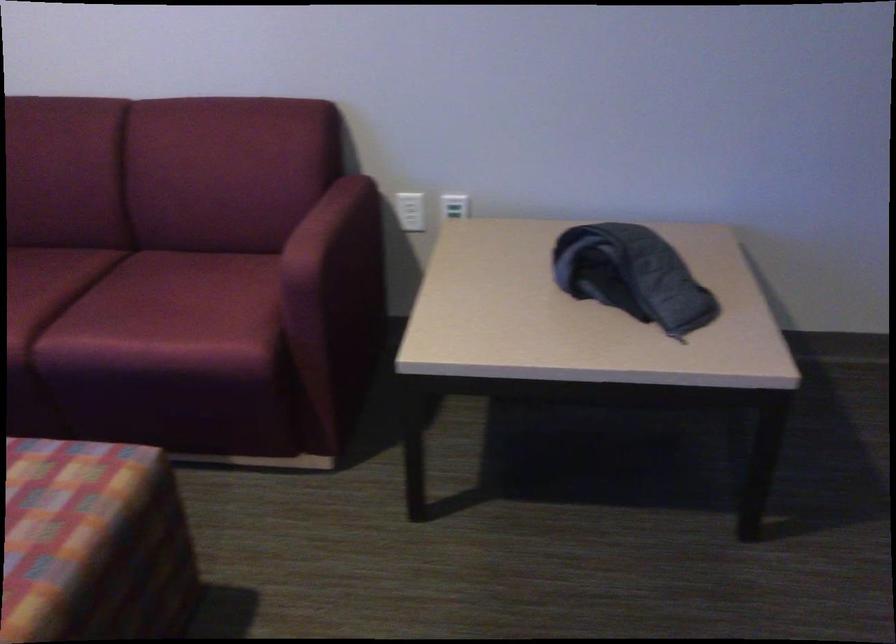
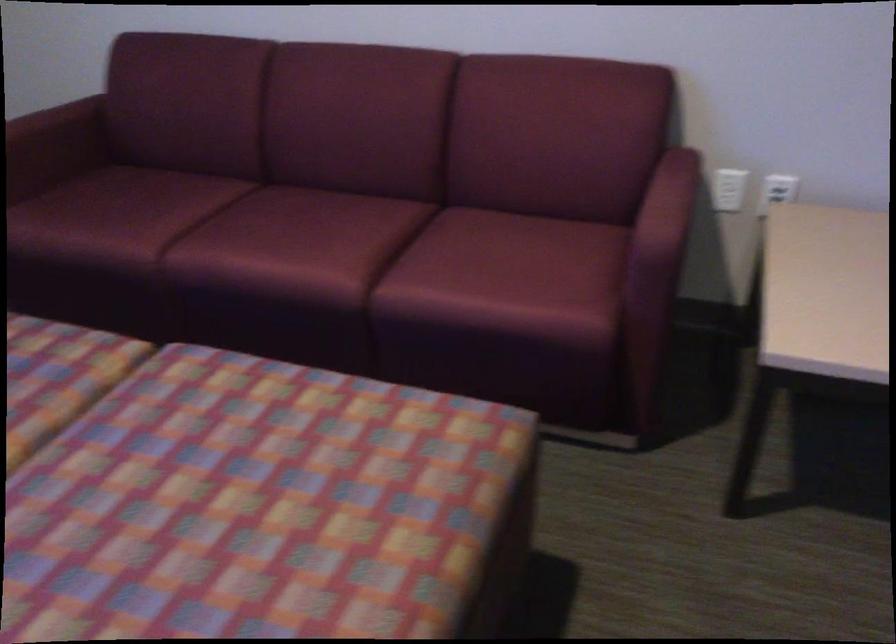
Locate, in the second image, the point that corresponds to pixel 414 207 in the first image.

(728, 189)